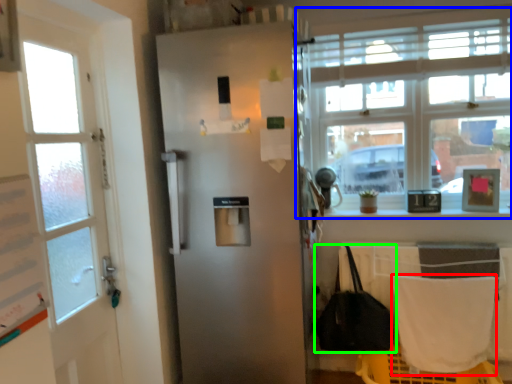
Question: Based on their relative distances, which object is nearer to blanket (highlighted by a red box)? Choose from window (highlighted by a blue box) and handbag (highlighted by a green box).

Choices:
 (A) window
 (B) handbag

Answer: (B)